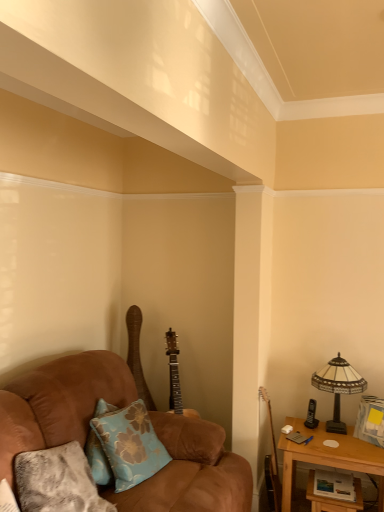
Question: From the image's perspective, is blue floral fabric pillow at lower left, which is the 1th pillow in back-to-front order, under brown suede couch at left?

Choices:
 (A) no
 (B) yes

Answer: (A)

Question: Does blue floral fabric pillow at lower left, which is the 1th pillow in back-to-front order, have a lesser height compared to brown suede couch at left?

Choices:
 (A) yes
 (B) no

Answer: (A)

Question: Can you confirm if blue floral fabric pillow at lower left, the 2th pillow when ordered from front to back, is taller than brown suede couch at left?

Choices:
 (A) yes
 (B) no

Answer: (B)

Question: Considering the relative sizes of blue floral fabric pillow at lower left, which is the 1th pillow in back-to-front order, and brown suede couch at left in the image provided, is blue floral fabric pillow at lower left, which is the 1th pillow in back-to-front order, thinner than brown suede couch at left?

Choices:
 (A) no
 (B) yes

Answer: (B)

Question: Is blue floral fabric pillow at lower left, which is the 1th pillow in back-to-front order, at the right side of brown suede couch at left?

Choices:
 (A) no
 (B) yes

Answer: (B)

Question: Does point (142, 378) appear closer or farther from the camera than point (110, 504)?

Choices:
 (A) closer
 (B) farther

Answer: (B)

Question: Looking at their shapes, would you say wooden acoustic guitar at center, which appears as the 2th guitar when viewed from the right, is wider or thinner than textured gray pillow at lower left, which is the second pillow in back-to-front order?

Choices:
 (A) thin
 (B) wide

Answer: (A)

Question: Considering the positions of wooden acoustic guitar at center, the 2th guitar when ordered from front to back, and textured gray pillow at lower left, which is the second pillow in back-to-front order, in the image, is wooden acoustic guitar at center, the 2th guitar when ordered from front to back, taller or shorter than textured gray pillow at lower left, which is the second pillow in back-to-front order,?

Choices:
 (A) short
 (B) tall

Answer: (B)

Question: From the image's perspective, is wooden acoustic guitar at center, which is the 1th guitar in left-to-right order, above or below textured gray pillow at lower left, which appears as the first pillow when viewed from the front?

Choices:
 (A) below
 (B) above

Answer: (B)

Question: From the image's perspective, is wooden acoustic guitar at right, which appears as the 1th guitar when viewed from the front, above or below stained glass lampshade at right?

Choices:
 (A) below
 (B) above

Answer: (A)

Question: From a real-world perspective, is wooden acoustic guitar at right, which ranks as the second guitar in back-to-front order, above or below stained glass lampshade at right?

Choices:
 (A) above
 (B) below

Answer: (B)

Question: In terms of size, does wooden acoustic guitar at right, placed as the 1th guitar when sorted from right to left, appear bigger or smaller than stained glass lampshade at right?

Choices:
 (A) big
 (B) small

Answer: (B)

Question: Is point (274, 485) positioned closer to the camera than point (360, 376)?

Choices:
 (A) farther
 (B) closer

Answer: (A)

Question: Do you think brown suede couch at left is within stained glass lampshade at right, or outside of it?

Choices:
 (A) outside
 (B) inside

Answer: (A)

Question: Looking at the image, does brown suede couch at left seem bigger or smaller compared to stained glass lampshade at right?

Choices:
 (A) small
 (B) big

Answer: (B)